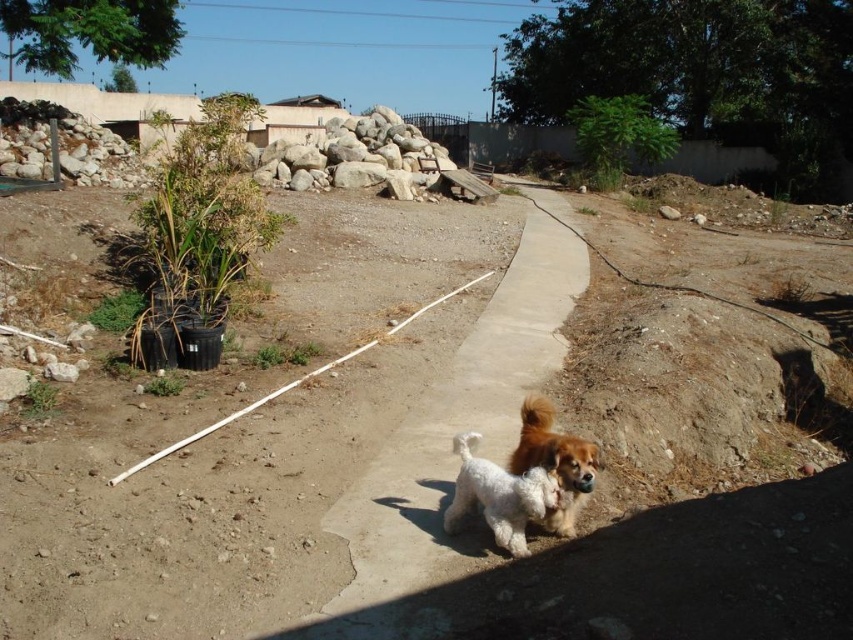
You are standing at the point marked by point (421, 460) in the image, which is located at the dirt track at center. You want to walk to the potted plants on the left. Which direction should you head?

You should head to the left towards the potted plants on the left since the point (421, 460) is at the dirt track at center, and the potted plants are located to the left of the pathway.

You are a photographer standing at the end of the pathway in the construction area. You see the white fluffy dog at center and the fluffy brown and white dog at center. Which dog is closer to you?

The white fluffy dog at center is closer to you because it is positioned further to the viewer than the fluffy brown and white dog at center.

You are a gardener who needs to move a heavy wheelbarrow from the dirt track at center to the concrete at center. Can you do this without the wheelbarrow getting stuck?

The dirt track at center and concrete at center are 1.20 meters apart, so yes, the wheelbarrow can be moved between them as the distance is manageable and the concrete surface is firmer, preventing the wheelbarrow from getting stuck.